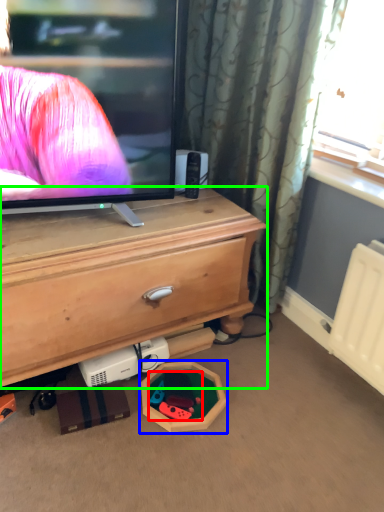
Question: Estimate the real-world distances between objects in this image. Which object is closer to toy (highlighted by a red box), toy (highlighted by a blue box) or chest of drawers (highlighted by a green box)?

Choices:
 (A) toy
 (B) chest of drawers

Answer: (A)